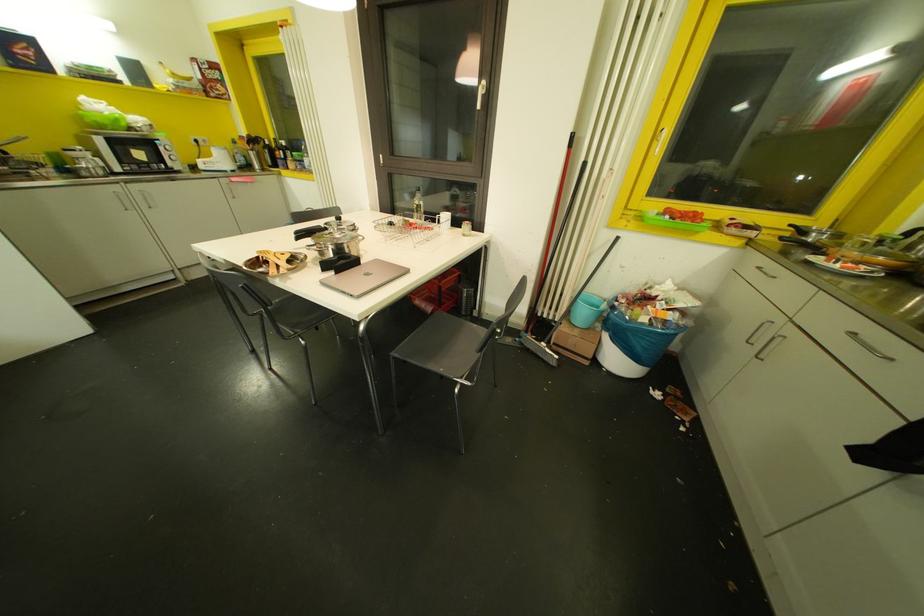
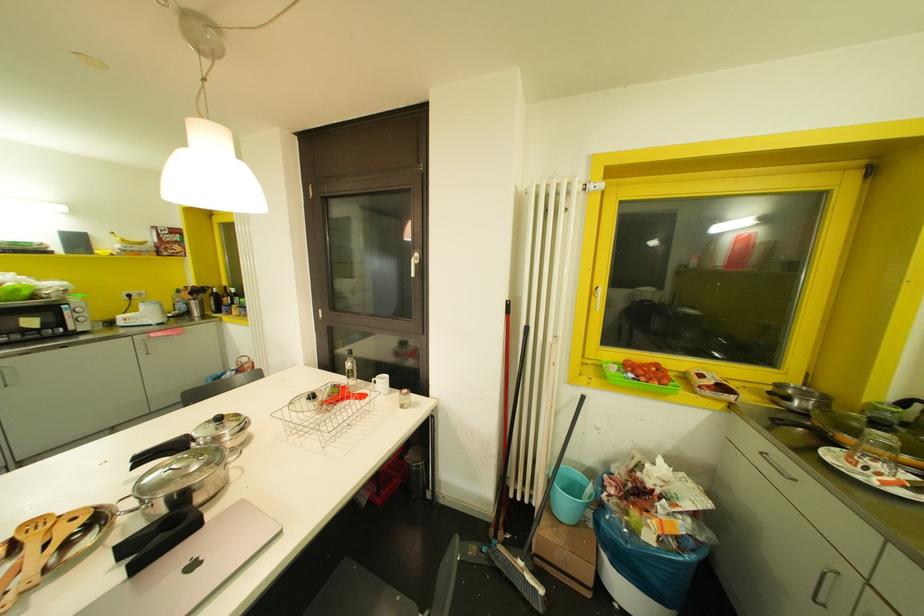
The point at [441,222] is marked in the first image. Where is the corresponding point in the second image?

(378, 384)